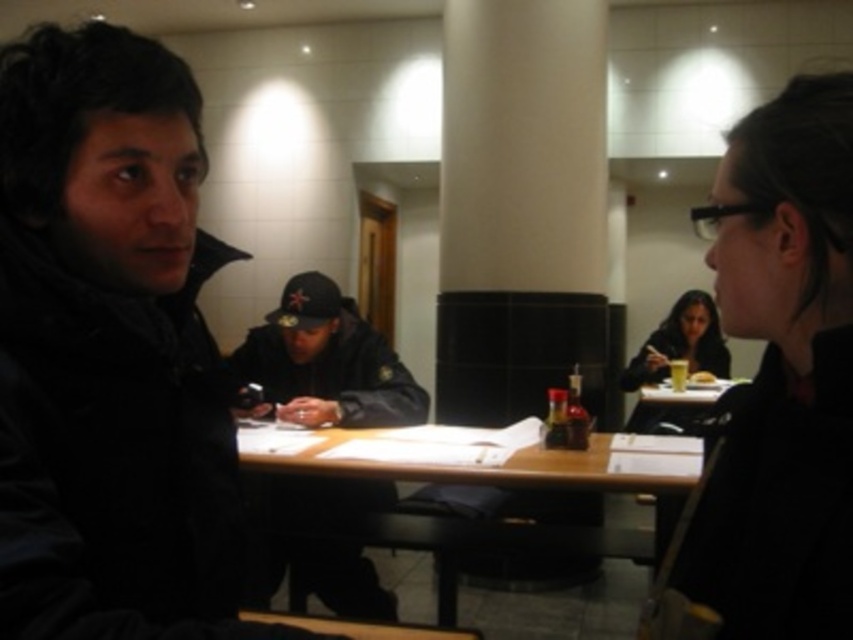
Question: Can you confirm if black matte jacket at left is bigger than matte black jacket at lower right?

Choices:
 (A) yes
 (B) no

Answer: (B)

Question: Which point appears farthest from the camera in this image?

Choices:
 (A) (688, 326)
 (B) (811, 289)
 (C) (326, 493)

Answer: (A)

Question: Which of these objects is positioned farthest from the black matte jacket at left?

Choices:
 (A) matte black jacket at lower right
 (B) black matte jacket at center
 (C) wooden table at center
 (D) black matte jacket at upper right

Answer: (A)

Question: Can you confirm if black matte jacket at upper right is positioned above matte black jacket at lower right?

Choices:
 (A) yes
 (B) no

Answer: (A)

Question: Is black matte jacket at left behind black matte jacket at center?

Choices:
 (A) yes
 (B) no

Answer: (B)

Question: Which object is positioned closest to the black matte jacket at center?

Choices:
 (A) wooden table at center
 (B) matte black jacket at lower right
 (C) black matte jacket at left

Answer: (A)